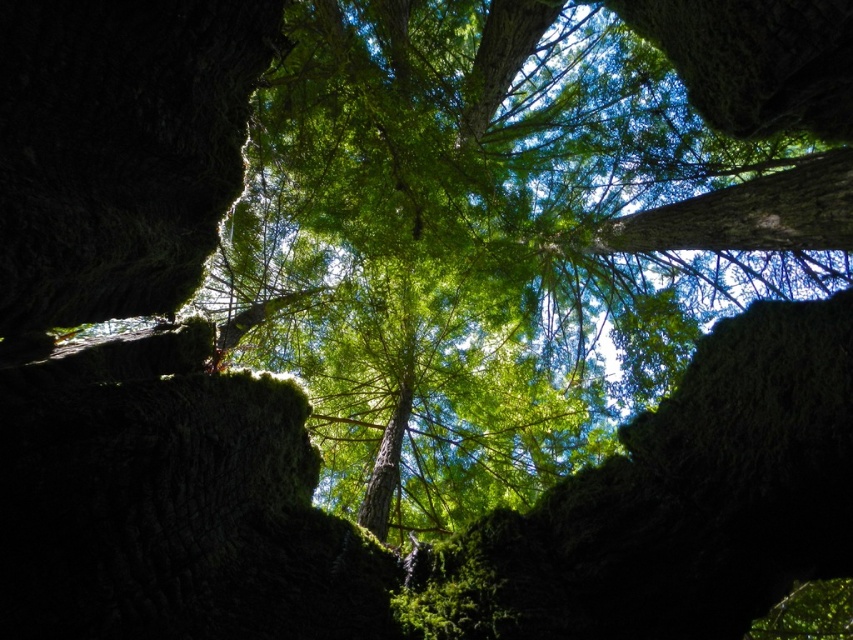
You are a bird looking for a nesting spot. You see the dark brown rough tree trunk at left and the green rough bark tree trunk at center. Which tree trunk would you choose if you want to build a nest higher up?

The dark brown rough tree trunk at left is much taller than the green rough bark tree trunk at center, so you should choose the dark brown rough tree trunk at left to build a nest higher up.